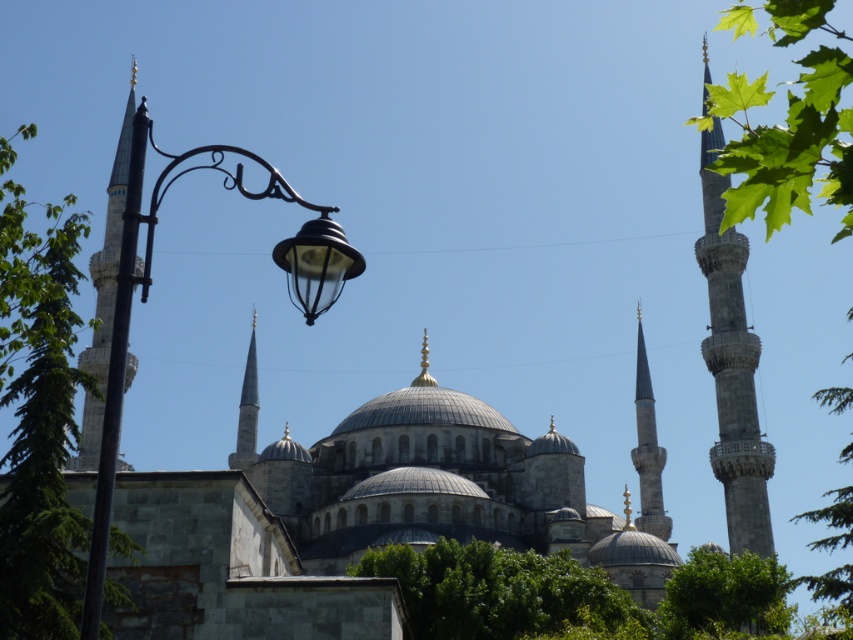
Question: Which of the following is the farthest from the observer?

Choices:
 (A) (102, 372)
 (B) (254, 198)
 (C) (641, 336)

Answer: (C)

Question: Based on their relative distances, which object is nearer to the black wrought iron street light at left?

Choices:
 (A) green leafy tree at lower center
 (B) green leafy tree at lower right

Answer: (A)

Question: Considering the relative positions of green leafy tree at lower center and black wrought iron street light at left in the image provided, where is green leafy tree at lower center located with respect to black wrought iron street light at left?

Choices:
 (A) below
 (B) above

Answer: (A)

Question: Based on their relative distances, which object is nearer to the black wrought iron street light at left?

Choices:
 (A) green leafy tree at lower right
 (B) smooth stone minaret at center-right
 (C) green leafy tree at lower center
 (D) green leafy tree at upper right

Answer: (C)

Question: From the image, what is the correct spatial relationship of green leafy tree at left in relation to green leafy tree at lower center?

Choices:
 (A) above
 (B) below

Answer: (A)

Question: Can you confirm if smooth stone minaret at left is bigger than smooth stone minaret at center-right?

Choices:
 (A) yes
 (B) no

Answer: (A)